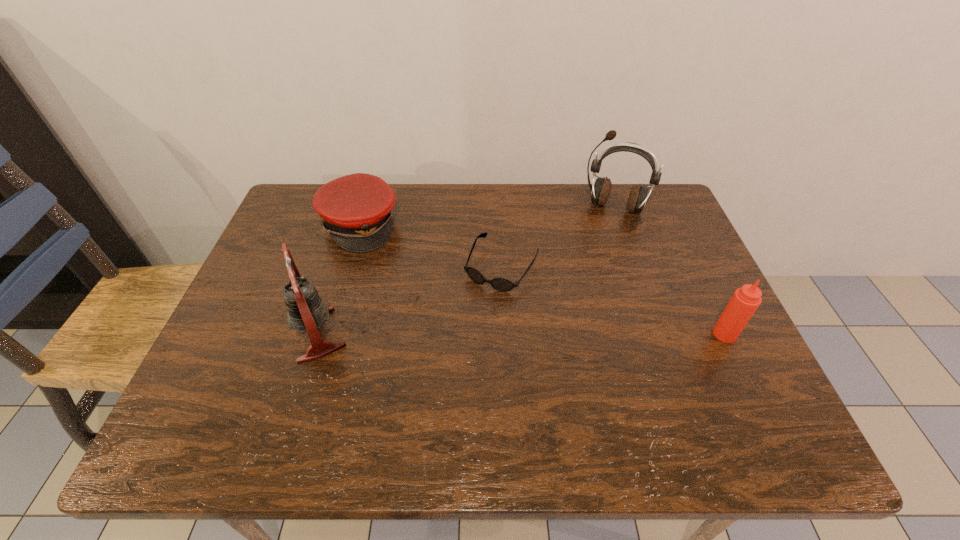
Locate an element on the screen. This screenshot has height=540, width=960. bell is located at coordinates (306, 311).

I want to click on Tabasco sauce, so click(745, 301).

This screenshot has width=960, height=540. I want to click on the rightmost object, so click(x=745, y=301).

The height and width of the screenshot is (540, 960). Find the location of `sunglasses`. sunglasses is located at coordinates (500, 284).

Image resolution: width=960 pixels, height=540 pixels. I want to click on the shortest object, so click(x=500, y=284).

At what (x,y) coordinates should I click in order to perform the action: click on the fourth object from left to right. Please return your answer as a coordinate pair (x, y). The width and height of the screenshot is (960, 540). Looking at the image, I should click on (600, 191).

Find the location of a particular element. cap is located at coordinates (357, 209).

Image resolution: width=960 pixels, height=540 pixels. I want to click on free space located on the back of the bell, so click(355, 212).

Where is `vacant region located on the left of the third tallest object`? This screenshot has height=540, width=960. vacant region located on the left of the third tallest object is located at coordinates (617, 334).

The image size is (960, 540). I want to click on vacant area situated 0.060m on the lenses of the shortest object, so click(x=476, y=308).